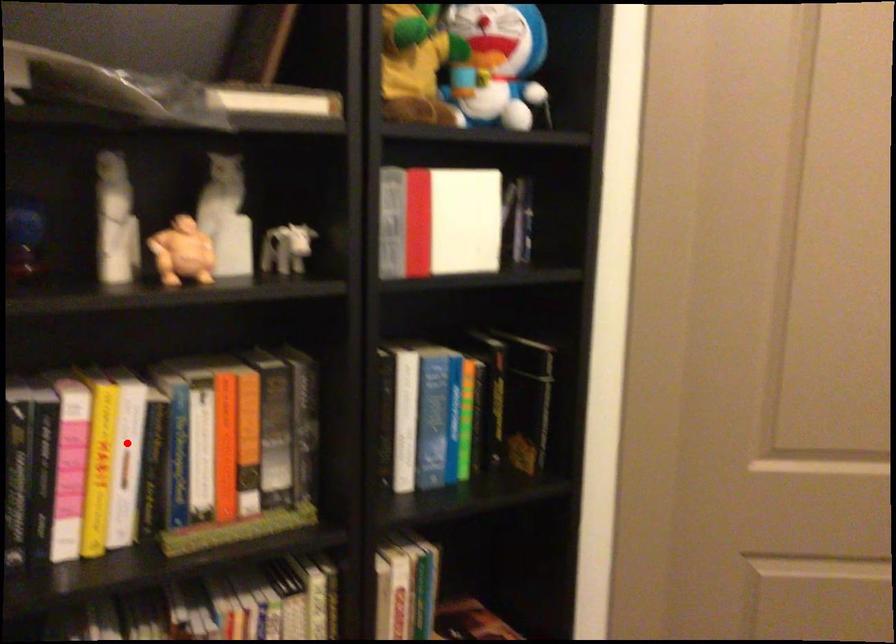
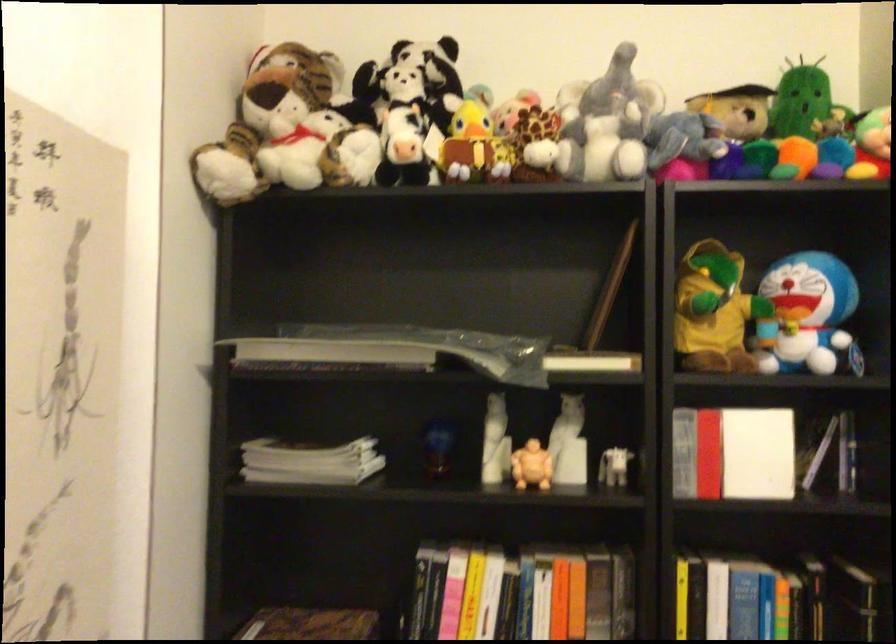
Locate, in the second image, the point that corresponds to the highlighted location in the first image.

(485, 599)